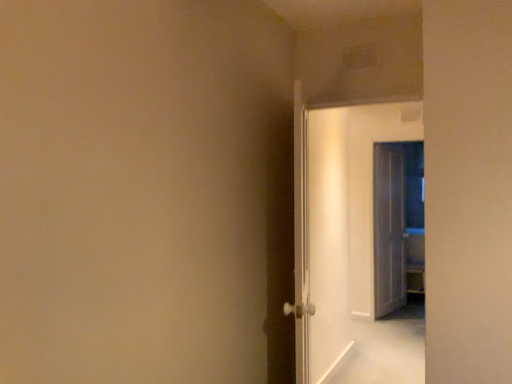
Question: From a real-world perspective, is translucent glass door at right, positioned as the third door in left-to-right order, on white glossy door at center, which is counted as the 1th door, starting from the left?

Choices:
 (A) yes
 (B) no

Answer: (B)

Question: From the image's perspective, is translucent glass door at right, the first door when ordered from right to left, located beneath white glossy door at center, the third door viewed from the right?

Choices:
 (A) yes
 (B) no

Answer: (A)

Question: Would you say white glossy door at center, the third door viewed from the right, is part of translucent glass door at right, positioned as the third door in left-to-right order,'s contents?

Choices:
 (A) no
 (B) yes

Answer: (A)

Question: Is translucent glass door at right, the first door when ordered from right to left, closer to the viewer compared to white glossy door at center, the third door viewed from the right?

Choices:
 (A) no
 (B) yes

Answer: (A)

Question: Can you confirm if translucent glass door at right, the first door when ordered from right to left, is shorter than white glossy door at center, which is counted as the 1th door, starting from the left?

Choices:
 (A) no
 (B) yes

Answer: (A)

Question: Would you consider translucent glass door at right, the 3th door positioned from the front, to be distant from white glossy door at center, placed as the first door when sorted from front to back?

Choices:
 (A) no
 (B) yes

Answer: (B)

Question: Is white glossy door at center, acting as the second door starting from the front, taller than translucent glass door at right, positioned as the third door in left-to-right order?

Choices:
 (A) no
 (B) yes

Answer: (A)

Question: From a real-world perspective, is white glossy door at center, acting as the second door starting from the front, over translucent glass door at right, positioned as the third door in left-to-right order?

Choices:
 (A) yes
 (B) no

Answer: (A)

Question: From the image's perspective, is white glossy door at center, acting as the 2th door starting from the left, located above translucent glass door at right, the 1th door from the back?

Choices:
 (A) no
 (B) yes

Answer: (B)

Question: Considering the relative positions of white glossy door at center, which is the 2th door from right to left, and translucent glass door at right, positioned as the third door in left-to-right order, in the image provided, is white glossy door at center, which is the 2th door from right to left, to the left of translucent glass door at right, positioned as the third door in left-to-right order, from the viewer's perspective?

Choices:
 (A) yes
 (B) no

Answer: (A)

Question: Can you see white glossy door at center, which appears as the second door when viewed from the back, touching translucent glass door at right, positioned as the third door in left-to-right order?

Choices:
 (A) no
 (B) yes

Answer: (A)

Question: Does white glossy door at center, acting as the second door starting from the front, appear on the right side of translucent glass door at right, the 3th door positioned from the front?

Choices:
 (A) yes
 (B) no

Answer: (B)

Question: Does white glossy door at center, placed as the first door when sorted from front to back, have a greater height compared to white glossy door at center, which appears as the second door when viewed from the back?

Choices:
 (A) no
 (B) yes

Answer: (A)